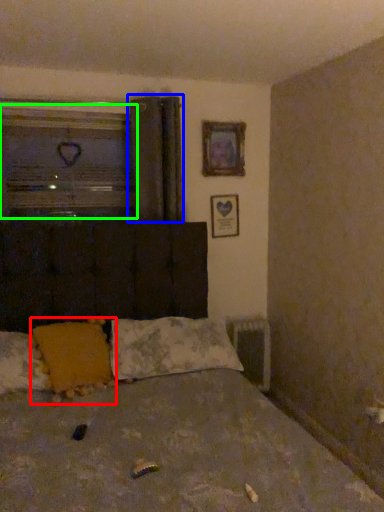
Question: Which is farther away from pillow (highlighted by a red box)? curtain (highlighted by a blue box) or window (highlighted by a green box)?

Choices:
 (A) curtain
 (B) window

Answer: (B)